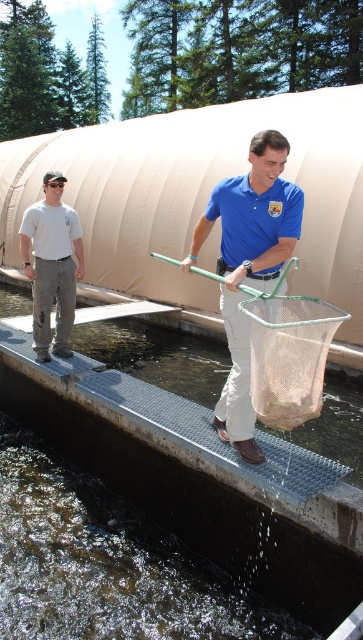
Based on the photo, can you confirm if blue smooth shirt at center is taller than metal mesh net at center?

Yes.

Who is more distant from viewer, (x=222, y=314) or (x=299, y=403)?

Positioned behind is point (x=222, y=314).

Identify the location of blue smooth shirt at center. The image size is (363, 640). (249, 266).

Who is positioned more to the right, clear liquid water at center or blue smooth shirt at center?

blue smooth shirt at center is more to the right.

Does clear liquid water at center lie in front of blue smooth shirt at center?

No, it is not.

Which is in front, point (9, 458) or point (279, 186)?

Point (279, 186) is more forward.

Where is `clear liquid water at center`? This screenshot has width=363, height=640. clear liquid water at center is located at coordinates (99, 564).

Does clear liquid water at center appear on the left side of metal mesh net at center?

Indeed, clear liquid water at center is positioned on the left side of metal mesh net at center.

Does point (194, 621) come behind point (286, 337)?

Yes, point (194, 621) is behind point (286, 337).

Where is `clear liquid water at center`? The height and width of the screenshot is (640, 363). clear liquid water at center is located at coordinates (99, 564).